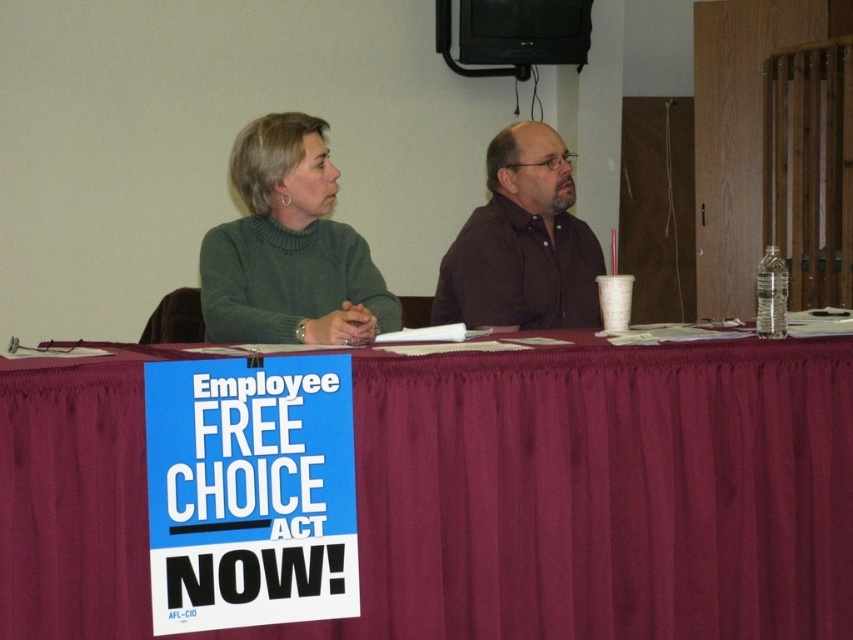
Does maroon fabric table at center have a smaller size compared to brown matte shirt at center?

No.

Does maroon fabric table at center have a lesser width compared to brown matte shirt at center?

No, maroon fabric table at center is not thinner than brown matte shirt at center.

Who is more distant from viewer, (722, 515) or (589, 232)?

Point (589, 232)

I want to click on maroon fabric table at center, so click(601, 493).

Can you confirm if green sweater at upper left is taller than brown matte shirt at center?

In fact, green sweater at upper left may be shorter than brown matte shirt at center.

This screenshot has height=640, width=853. Describe the element at coordinates (289, 248) in the screenshot. I see `green sweater at upper left` at that location.

I want to click on green sweater at upper left, so click(x=289, y=248).

Where is `maroon fabric table at center`? This screenshot has width=853, height=640. maroon fabric table at center is located at coordinates (601, 493).

Which of these two, maroon fabric table at center or green sweater at upper left, stands taller?

maroon fabric table at center is taller.

Image resolution: width=853 pixels, height=640 pixels. Identify the location of maroon fabric table at center. (601, 493).